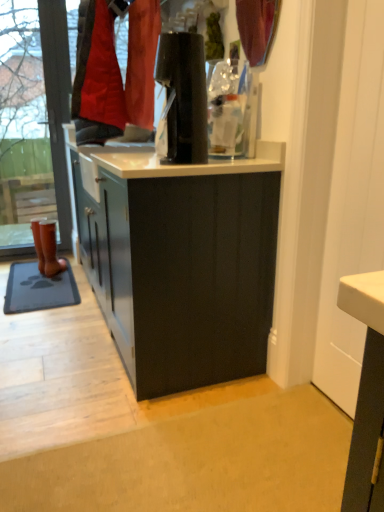
The image size is (384, 512). Identify the location of vacant area that is in front of brown leather boot at left. (53, 276).